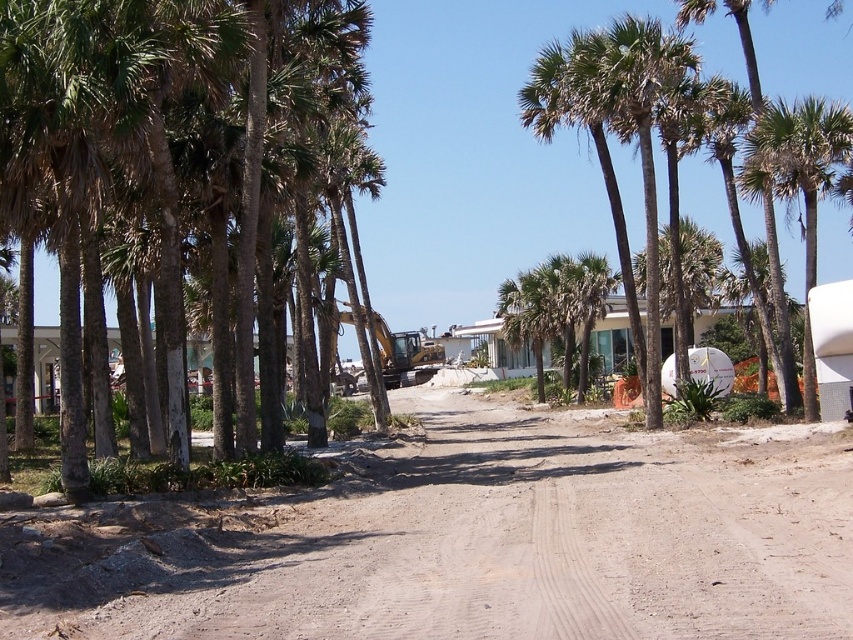
Does point (59, 93) come closer to viewer compared to point (775, 170)?

Yes, point (59, 93) is in front of point (775, 170).

Which is behind, point (4, 24) or point (817, 164)?

The point (817, 164) is more distant.

Where is `green leafy palm trees at left`? The width and height of the screenshot is (853, 640). green leafy palm trees at left is located at coordinates (142, 109).

Image resolution: width=853 pixels, height=640 pixels. I want to click on green leafy palm trees at left, so click(x=142, y=109).

Is green leafy palm tree at right taller than green leafy palm tree at center?

In fact, green leafy palm tree at right may be shorter than green leafy palm tree at center.

Which is more to the left, green leafy palm tree at right or green leafy palm tree at center?

green leafy palm tree at center is more to the left.

This screenshot has width=853, height=640. In order to click on green leafy palm tree at right in this screenshot , I will do `click(798, 160)`.

Who is positioned more to the right, brown sandy dirt at center or green leafy palm tree at right?

green leafy palm tree at right is more to the right.

Is point (282, 502) positioned in front of point (761, 136)?

Yes, point (282, 502) is closer to viewer.

Find the location of a particular element. Image resolution: width=853 pixels, height=640 pixels. brown sandy dirt at center is located at coordinates (469, 541).